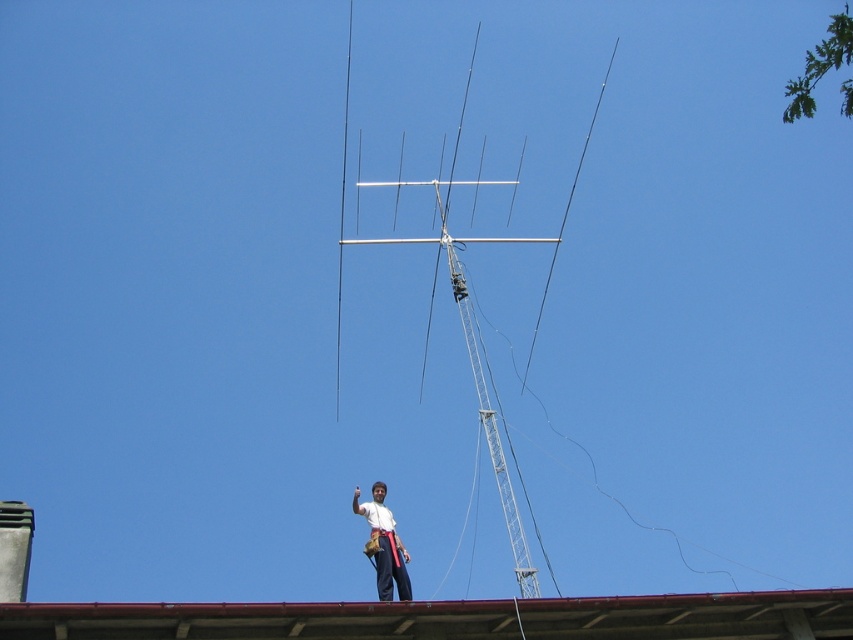
You are a construction worker assessing the scene. You need to place a 2m wide safety net between the red metal roof at center and the white fabric shirt at center. Can the safety net fit horizontally between them?

The red metal roof at center might be wider than white fabric shirt at center, so the safety net might fit horizontally between them if the distance between them is at least 2 meters. However, the exact width difference isn not specified, so further measurement is needed to confirm.

You are a safety inspector checking the scene. The safety regulations state that the minimum safe distance between a worker and the edge of a roof must be at least 10 meters. Given the distance between the red metal roof at center and the white fabric shirt at center, is the worker complying with the safety regulations?

The distance between the red metal roof at center and the white fabric shirt at center is 9.43 meters, which is less than the required 10 meters. Therefore, the worker is not complying with the safety regulations.